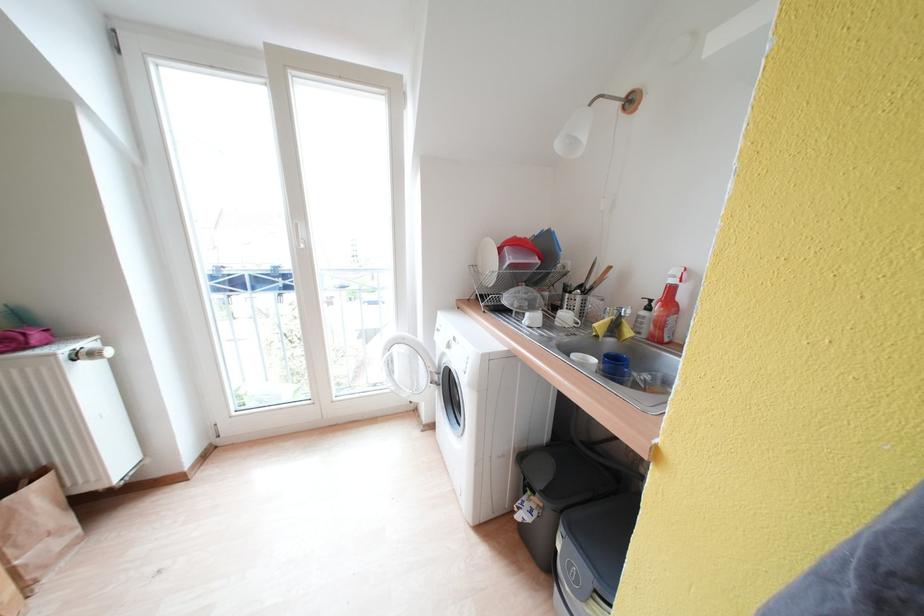
The image size is (924, 616). Describe the element at coordinates (617, 318) in the screenshot. I see `a sink faucet handle` at that location.